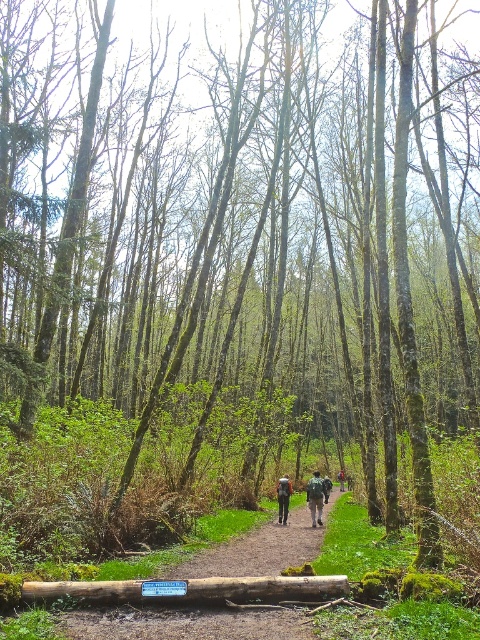
You are standing at the starting point of the dirt path in the forest scene. You see two points marked on the path. Which point is closer to you, point 1 at coordinates (128, 582) or point 2 at coordinates (320, 483)?

Point 1 at coordinates (128, 582) is closer to you because it is nearer to the camera compared to point 2 at coordinates (320, 483).

You are a hiker walking along the dirt path in the forest scene. You want to place your backpack on the ground near the point marked as point (194,589). Is there a brown rough log at lower center at that location?

Yes, the brown rough log at lower center is located at point (194,589), so you can place your backpack there near it.

You are a hiker carrying an orange fabric backpack at center and need to cross a brown rough log at lower center. Can you safely step onto the log if your backpack is wider than the log?

The brown rough log at lower center is wider than the orange fabric backpack at center, so you can safely step onto the log since the log is wide enough to support your weight even with the backpack.